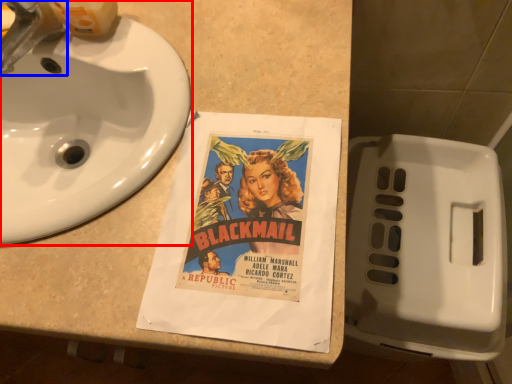
Question: Among these objects, which one is farthest to the camera, sink (highlighted by a red box) or faucet (highlighted by a blue box)?

Choices:
 (A) sink
 (B) faucet

Answer: (B)